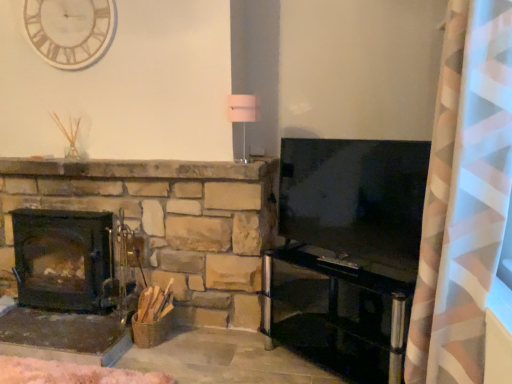
At what (x,y) coordinates should I click in order to perform the action: click on free spot below white wooden clock at upper left (from a real-world perspective). Please return your answer as a coordinate pair (x, y). Looking at the image, I should click on (86, 155).